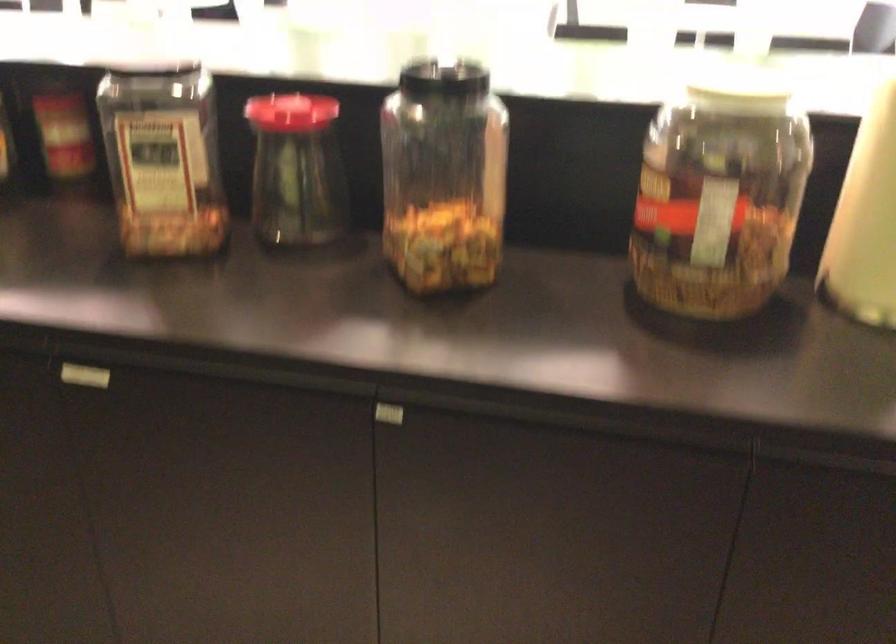
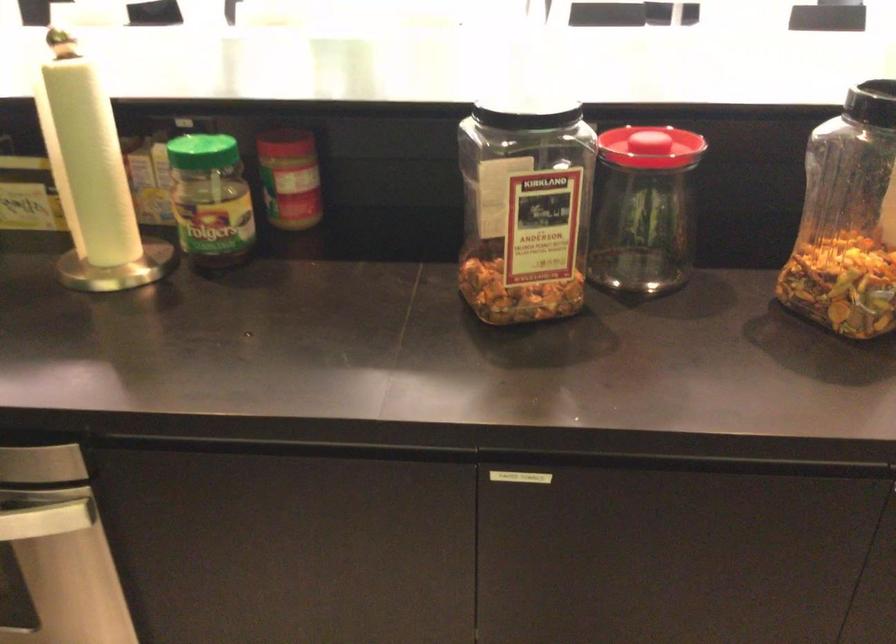
Question: The camera is either moving clockwise (left) or counter-clockwise (right) around the object. The first image is from the beginning of the video and the second image is from the end. Is the camera moving left or right when shooting the video?

Choices:
 (A) Left
 (B) Right

Answer: (A)